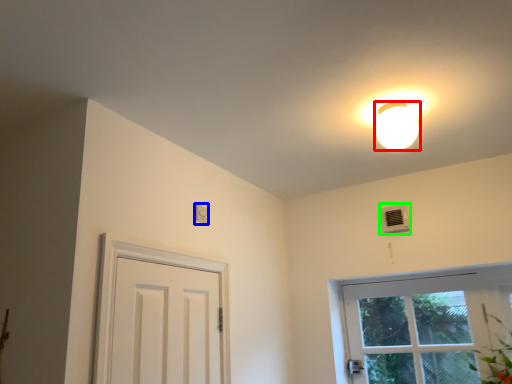
Question: Which object is the farthest from lamp (highlighted by a red box)? Choose among these: light switch (highlighted by a blue box) or air conditioner (highlighted by a green box).

Choices:
 (A) light switch
 (B) air conditioner

Answer: (A)